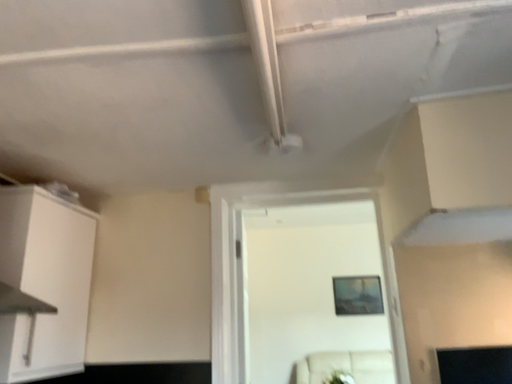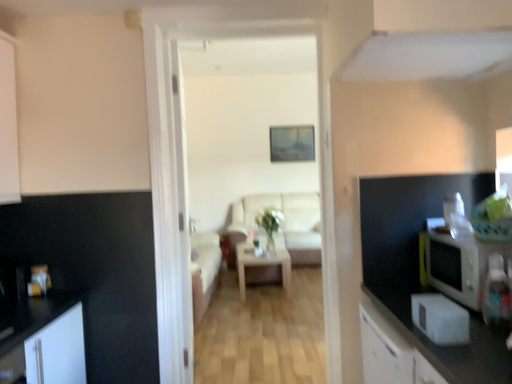
Question: Which way did the camera rotate in the video?

Choices:
 (A) rotated right
 (B) rotated left

Answer: (A)